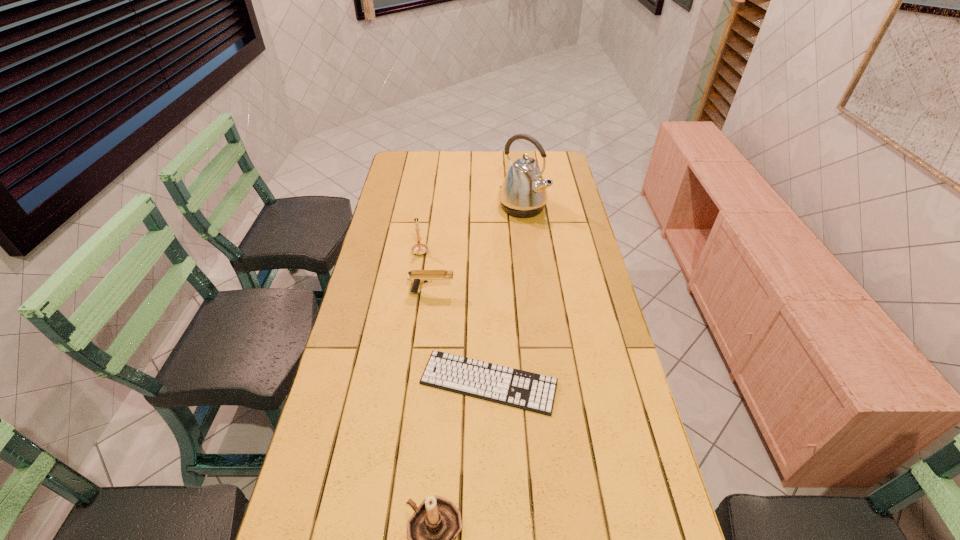
In the image, there is a desktop. At what (x,y) coordinates should I click in order to perform the action: click on blank space at the far right corner. Please return your answer as a coordinate pair (x, y). This screenshot has height=540, width=960. Looking at the image, I should click on (539, 165).

Identify the location of free space between the tallest object and the fourth farthest object. (506, 295).

At what (x,y) coordinates should I click in order to perform the action: click on vacant space in between the farthest object and the shortest object. Please return your answer as a coordinate pair (x, y). The height and width of the screenshot is (540, 960). Looking at the image, I should click on (506, 295).

Where is `free space between the third farthest object and the kettle`? The image size is (960, 540). free space between the third farthest object and the kettle is located at coordinates (477, 249).

Where is `vacant space in between the farthest object and the pistol`? vacant space in between the farthest object and the pistol is located at coordinates (477, 249).

Find the location of a particular element. This screenshot has height=540, width=960. unoccupied area between the tallest object and the third farthest object is located at coordinates (477, 249).

This screenshot has height=540, width=960. Find the location of `unoccupied position between the second nearest object and the third farthest object`. unoccupied position between the second nearest object and the third farthest object is located at coordinates (460, 338).

The width and height of the screenshot is (960, 540). What are the coordinates of `object that is the third closest to the second shortest object` in the screenshot? It's located at (523, 193).

Locate an element on the screen. The image size is (960, 540). object that ranks as the third closest to the left candle holder is located at coordinates (516, 388).

This screenshot has height=540, width=960. In order to click on free space that satisfies the following two spatial constraints: 1. on the handle side of the tallest object; 2. on the left side of the left candle holder in this screenshot , I will do `click(427, 207)`.